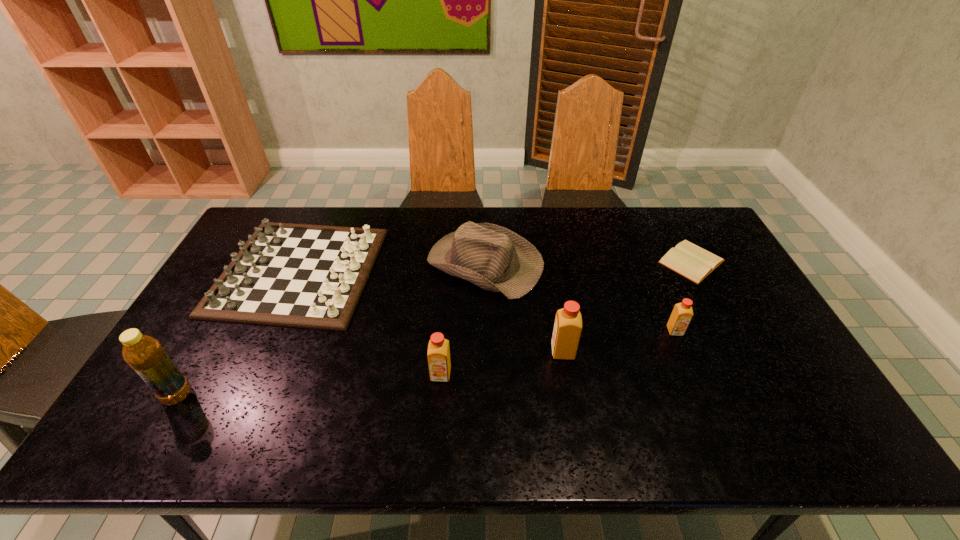
You are a GUI agent. You are given a task and a screenshot of the screen. Output one action in this format:
    pyautogui.click(x=<x>, y=<y>)
    Task: Click on the vacant place for an extra orange juice on the left
    Image resolution: width=960 pixels, height=540 pixels.
    Given the screenshot: What is the action you would take?
    pyautogui.click(x=307, y=400)